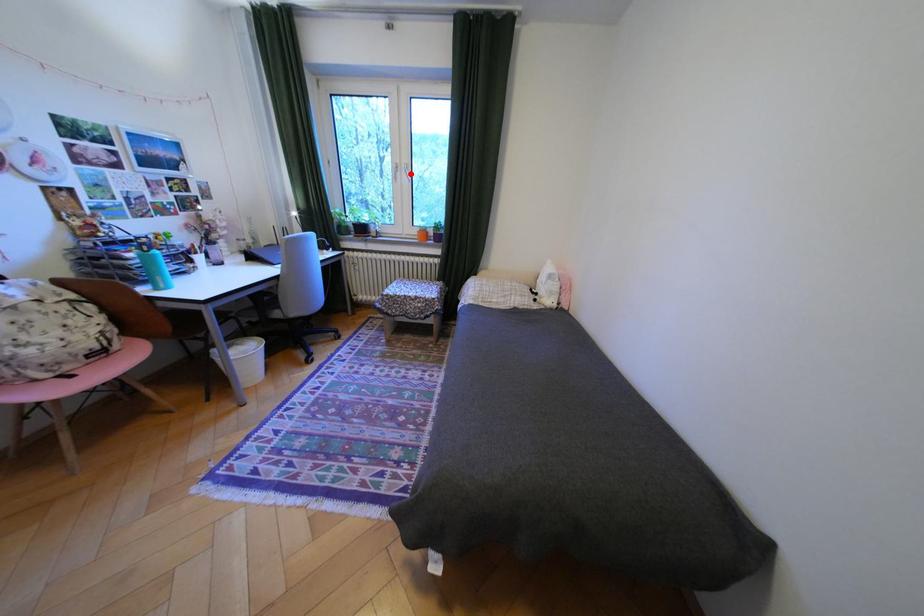
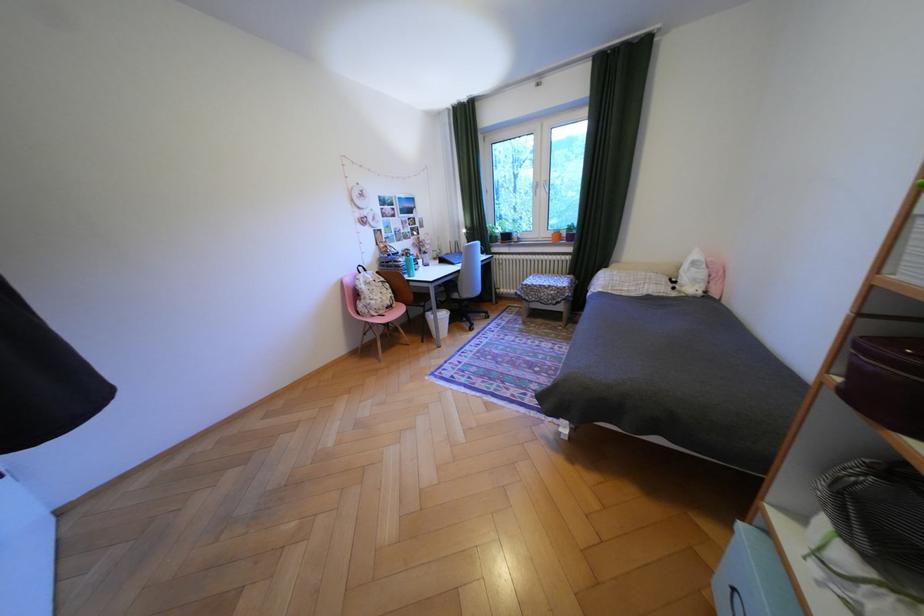
Find the pixel in the second image that matches the highlighted location in the first image.

(551, 190)